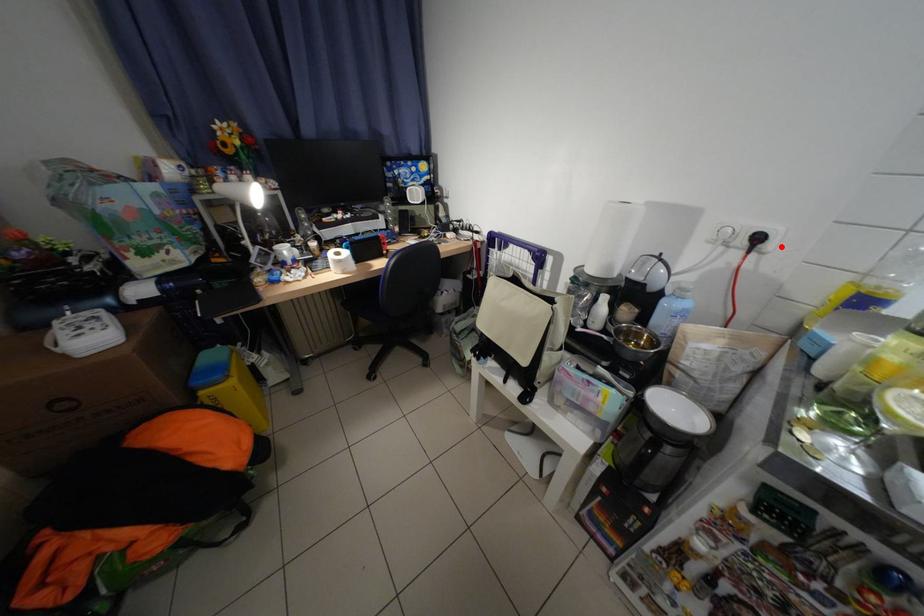
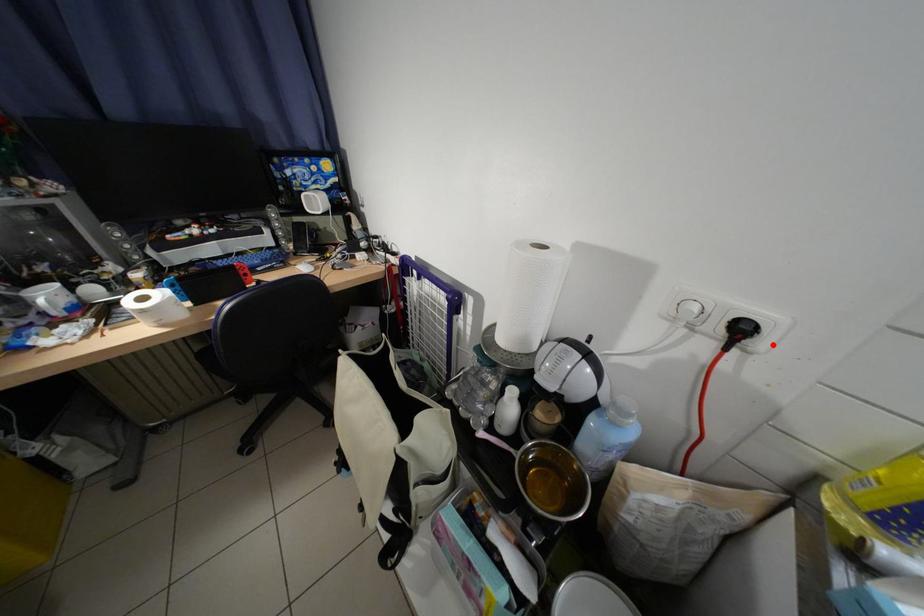
I am providing you with two images of the same scene from different viewpoints. A red point is marked on the first image and another point is marked on the second image. Do the highlighted points in image1 and image2 indicate the same real-world spot?

Yes